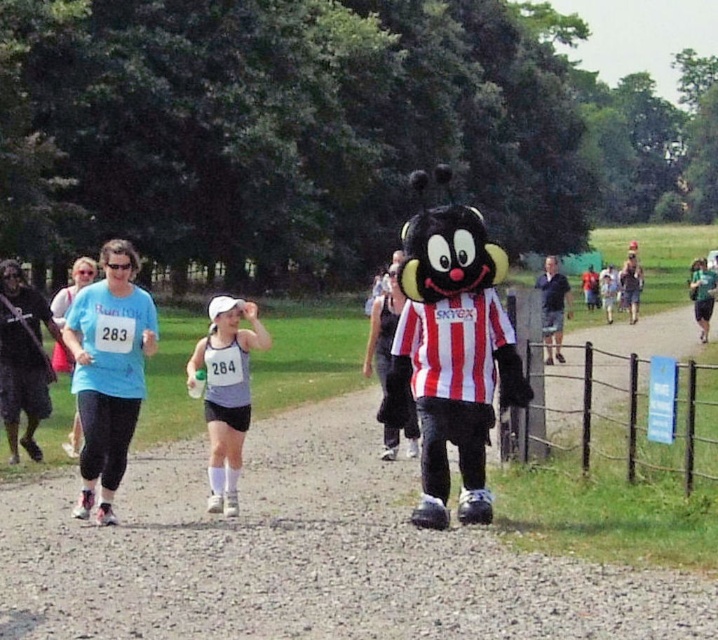
Can you confirm if light blue t-shirt at center is positioned below gray fabric tank top at center?

No.

From the picture: Can you confirm if light blue t-shirt at center is thinner than gray fabric tank top at center?

Yes, light blue t-shirt at center is thinner than gray fabric tank top at center.

Who is more distant from viewer, (146, 339) or (228, 356)?

The point (228, 356) is behind.

The image size is (718, 640). Find the location of `light blue t-shirt at center`. light blue t-shirt at center is located at coordinates (108, 371).

Is gray fabric tank top at center shorter than blue fabric shirt at right?

Yes.

Identify the location of gray fabric tank top at center. (225, 392).

Is light blue t-shirt at center closer to camera compared to blue fabric shirt at right?

Yes, light blue t-shirt at center is closer to the viewer.

Who is taller, light blue t-shirt at center or blue fabric shirt at right?

blue fabric shirt at right is taller.

Does point (129, 266) come farther from viewer compared to point (556, 285)?

No.

Identify the location of light blue t-shirt at center. (108, 371).